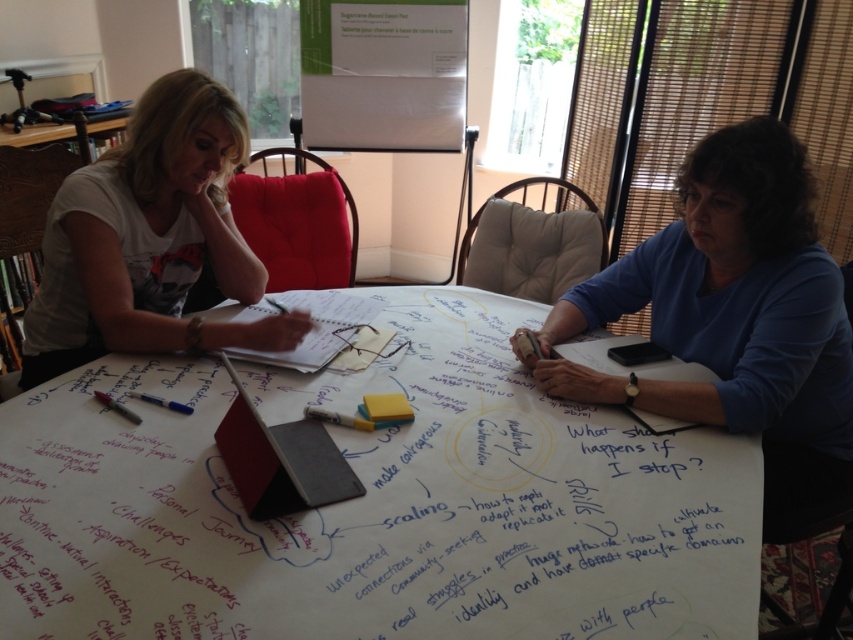
Based on the photo, you are a participant in the brainstorming session and need to reach for a pen. The white matte pen at center and the matte black pen at lower left are both on the table. Which pen is closer to you?

The white matte pen at center is closer to you because it is further to the viewer than the matte black pen at lower left.

You are a person with a 3.5 feet long arm. You want to pick up the white matte pen at center from your current position. Can you reach it?

The white matte pen at center is 4.09 feet away from viewer, so no, you cannot reach it with a 3.5 feet long arm.